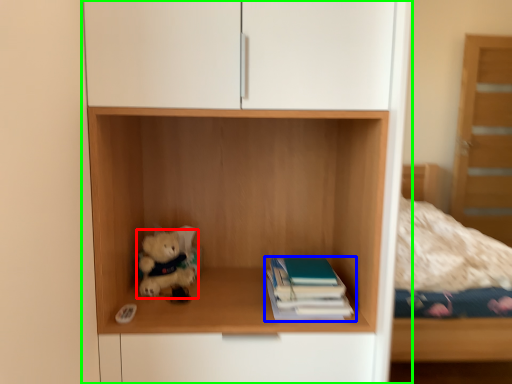
Question: Based on their relative distances, which object is farther from teddy bear (highlighted by a red box)? Choose from book (highlighted by a blue box) and cupboard (highlighted by a green box).

Choices:
 (A) book
 (B) cupboard

Answer: (B)